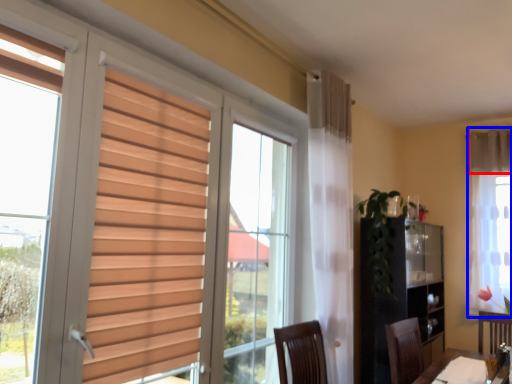
Question: Which point is further to the camera, curtain (highlighted by a red box) or curtain (highlighted by a blue box)?

Choices:
 (A) curtain
 (B) curtain

Answer: (A)